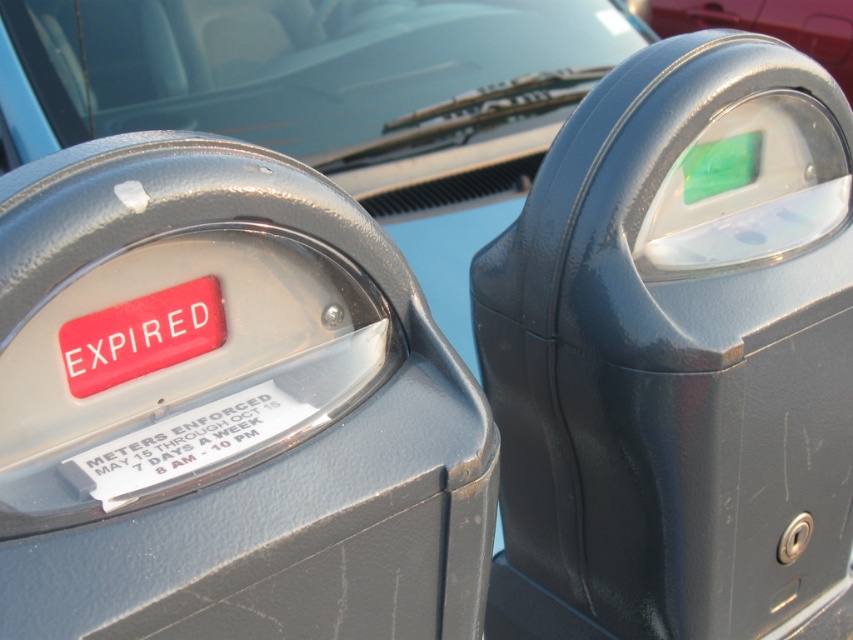
Who is higher up, glossy plastic parking meter at center or metallic red car at upper right?

metallic red car at upper right

Does glossy plastic parking meter at center appear on the right side of metallic red car at upper right?

In fact, glossy plastic parking meter at center is to the left of metallic red car at upper right.

Locate an element on the screen. This screenshot has height=640, width=853. glossy plastic parking meter at center is located at coordinates click(x=676, y=353).

What are the coordinates of `glossy plastic parking meter at center` in the screenshot? It's located at (676, 353).

In the scene shown: Is matte gray parking meter at left to the left of metallic red car at upper right from the viewer's perspective?

Yes, matte gray parking meter at left is to the left of metallic red car at upper right.

Is point (22, 499) behind point (654, 29)?

No, (22, 499) is closer to viewer.

Which is in front, point (10, 477) or point (787, 42)?

Positioned in front is point (10, 477).

Find the location of a particular element. Image resolution: width=853 pixels, height=640 pixels. matte gray parking meter at left is located at coordinates (225, 408).

Based on the photo, who is shorter, matte gray parking meter at left or white paper sticker at center?

white paper sticker at center is shorter.

Can you confirm if matte gray parking meter at left is positioned to the left of white paper sticker at center?

In fact, matte gray parking meter at left is to the right of white paper sticker at center.

The height and width of the screenshot is (640, 853). Describe the element at coordinates (225, 408) in the screenshot. I see `matte gray parking meter at left` at that location.

At what (x,y) coordinates should I click in order to perform the action: click on matte gray parking meter at left. Please return your answer as a coordinate pair (x, y). The image size is (853, 640). Looking at the image, I should click on (225, 408).